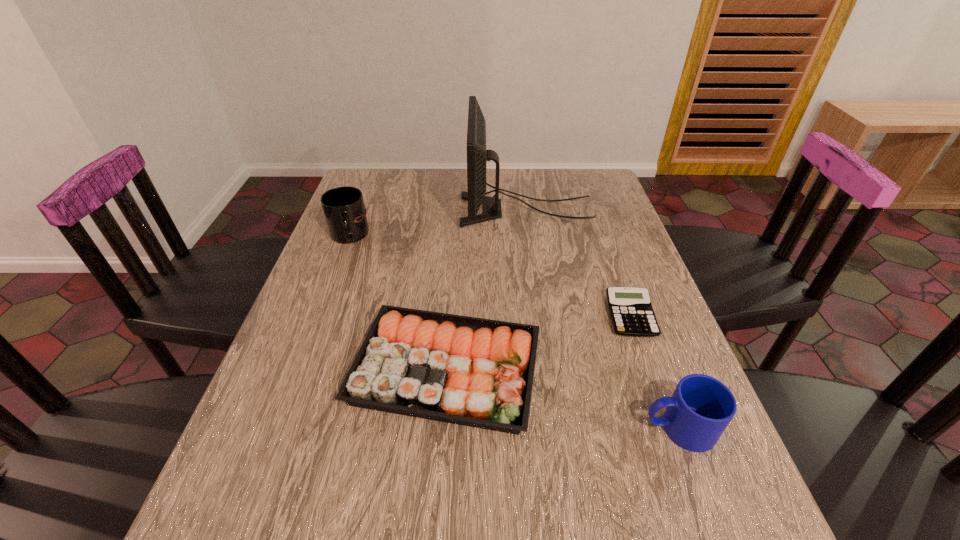
Locate an element on the screen. The height and width of the screenshot is (540, 960). mug located at the right edge is located at coordinates (701, 407).

Find the location of a particular element. The width and height of the screenshot is (960, 540). calculator at the right edge is located at coordinates (630, 308).

Find the location of a particular element. The width and height of the screenshot is (960, 540). object that is at the far right corner is located at coordinates (477, 156).

This screenshot has height=540, width=960. I want to click on free space at the far edge of the desktop, so click(x=499, y=183).

The image size is (960, 540). In order to click on vacant region at the near edge of the desktop in this screenshot , I will do `click(482, 539)`.

Find the location of a particular element. free space at the left edge is located at coordinates (324, 287).

In the image, there is a desktop. At what (x,y) coordinates should I click in order to perform the action: click on vacant space at the right edge. Please return your answer as a coordinate pair (x, y). Looking at the image, I should click on [684, 451].

I want to click on vacant area at the far right corner, so click(x=575, y=194).

Where is `vacant point located between the leftmost object and the shortest object`? vacant point located between the leftmost object and the shortest object is located at coordinates (490, 276).

This screenshot has height=540, width=960. What are the coordinates of `vacant region between the shortest object and the farther mug` in the screenshot? It's located at (490, 276).